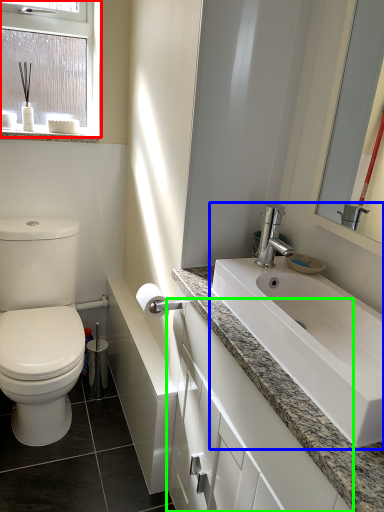
Question: Which is farther away from window (highlighted by a red box)? sink (highlighted by a blue box) or bathroom cabinet (highlighted by a green box)?

Choices:
 (A) sink
 (B) bathroom cabinet

Answer: (B)